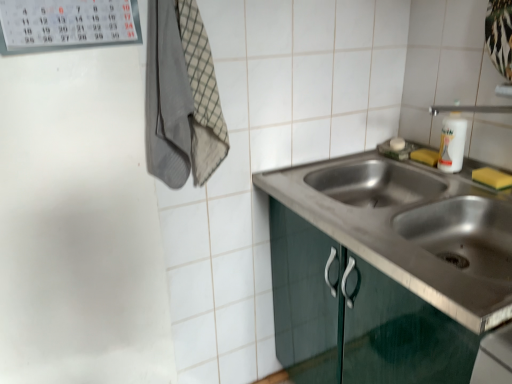
Question: Is yellow sponge at sink right, which appears as the first soap when viewed from the back, oriented away from yellow sponge at right, which ranks as the second soap in back-to-front order?

Choices:
 (A) no
 (B) yes

Answer: (A)

Question: Is yellow sponge at sink right, positioned as the second soap in front-to-back order, further to camera compared to yellow sponge at right, which is the 2th soap in left-to-right order?

Choices:
 (A) no
 (B) yes

Answer: (B)

Question: Is yellow sponge at sink right, positioned as the second soap in front-to-back order, taller than yellow sponge at right, arranged as the first soap when viewed from the right?

Choices:
 (A) no
 (B) yes

Answer: (A)

Question: Considering the relative sizes of yellow sponge at sink right, which appears as the first soap when viewed from the back, and yellow sponge at right, which is the 2th soap in left-to-right order, in the image provided, is yellow sponge at sink right, which appears as the first soap when viewed from the back, bigger than yellow sponge at right, which is the 2th soap in left-to-right order,?

Choices:
 (A) yes
 (B) no

Answer: (A)

Question: Can you confirm if yellow sponge at sink right, placed as the first soap when sorted from left to right, is smaller than yellow sponge at right, which is the second soap in top-to-bottom order?

Choices:
 (A) yes
 (B) no

Answer: (B)

Question: From the image's perspective, is yellow sponge at sink right, placed as the first soap when sorted from left to right, located above yellow sponge at right, which is the second soap in top-to-bottom order?

Choices:
 (A) yes
 (B) no

Answer: (A)

Question: Is yellow sponge at right, arranged as the first soap when ordered from the bottom, bigger than white glossy bottle at upper right?

Choices:
 (A) no
 (B) yes

Answer: (A)

Question: Is yellow sponge at right, arranged as the first soap when viewed from the right, located outside white glossy bottle at upper right?

Choices:
 (A) yes
 (B) no

Answer: (A)

Question: Does yellow sponge at right, which is the second soap in top-to-bottom order, come in front of white glossy bottle at upper right?

Choices:
 (A) yes
 (B) no

Answer: (A)

Question: Considering the relative sizes of yellow sponge at right, arranged as the first soap when viewed from the right, and white glossy bottle at upper right in the image provided, is yellow sponge at right, arranged as the first soap when viewed from the right, thinner than white glossy bottle at upper right?

Choices:
 (A) yes
 (B) no

Answer: (B)

Question: From a real-world perspective, is yellow sponge at right, arranged as the first soap when viewed from the right, under white glossy bottle at upper right?

Choices:
 (A) yes
 (B) no

Answer: (A)

Question: Does yellow sponge at right, which is the second soap in top-to-bottom order, have a greater width compared to white glossy bottle at upper right?

Choices:
 (A) no
 (B) yes

Answer: (B)

Question: Is yellow sponge at sink right, which appears as the first soap when viewed from the back, inside yellow sponge at right, which is the 1th soap in front-to-back order?

Choices:
 (A) yes
 (B) no

Answer: (B)